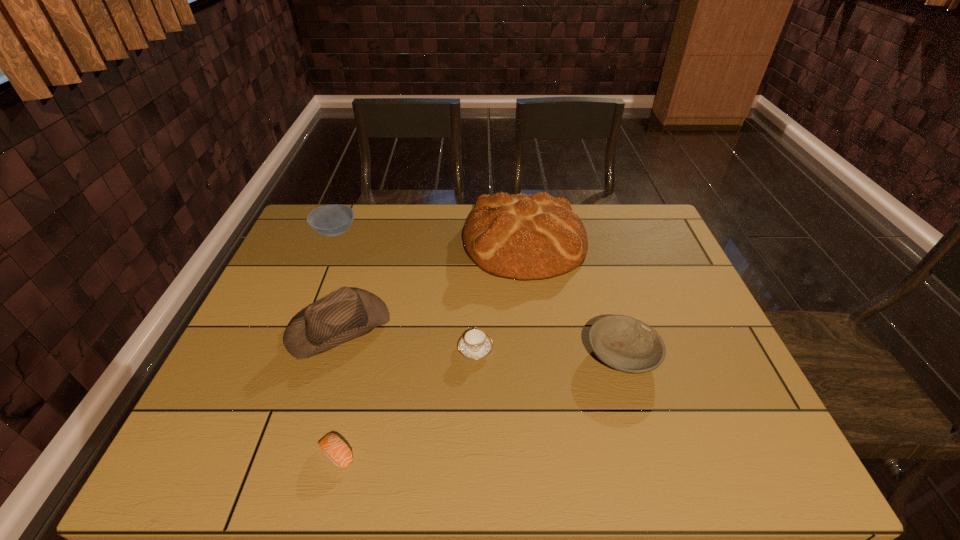
The width and height of the screenshot is (960, 540). Identify the location of vacant space in between the tallest object and the fedora. (431, 284).

Image resolution: width=960 pixels, height=540 pixels. Find the location of `free space between the fourth shortest object and the teacup`. free space between the fourth shortest object and the teacup is located at coordinates (405, 291).

At what (x,y) coordinates should I click in order to perform the action: click on free space between the teacup and the sushi. Please return your answer as a coordinate pair (x, y). This screenshot has height=540, width=960. Looking at the image, I should click on (406, 402).

This screenshot has height=540, width=960. I want to click on free space between the fedora and the nearest object, so click(338, 391).

Identify the location of vacant area that lies between the fourth shortest object and the fedora. The width and height of the screenshot is (960, 540). (337, 279).

You are a GUI agent. You are given a task and a screenshot of the screen. Output one action in this format:
    pyautogui.click(x=<x>, y=<y>)
    Task: Click on the empty space that is in between the sushi and the teacup
    Image resolution: width=960 pixels, height=540 pixels.
    Given the screenshot: What is the action you would take?
    pyautogui.click(x=406, y=402)

The height and width of the screenshot is (540, 960). What are the coordinates of `empty space that is in between the fifth shortest object and the third tallest object` in the screenshot? It's located at (337, 279).

Locate an element on the screen. This screenshot has height=540, width=960. vacant area between the teacup and the nearer bowl is located at coordinates (549, 352).

Identify the location of the third closest object to the teacup. (628, 345).

Identify which object is located as the third nearest to the bread. Please provide its 2D coordinates. Your answer should be formatted as a tuple, i.e. [(x, y)], where the tuple contains the x and y coordinates of a point satisfying the conditions above.

[(475, 344)]